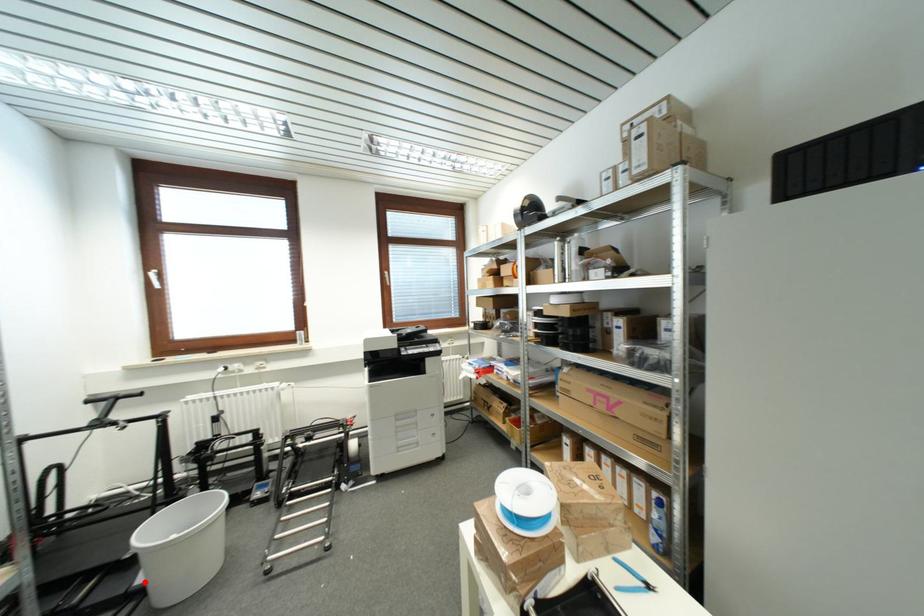
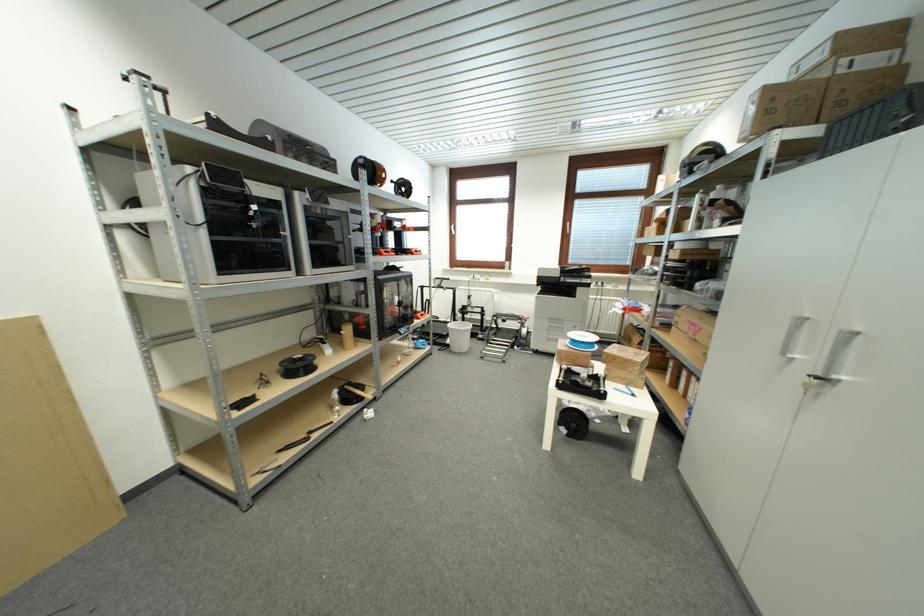
The point at the highlighted location is marked in the first image. Where is the corresponding point in the second image?

(453, 344)